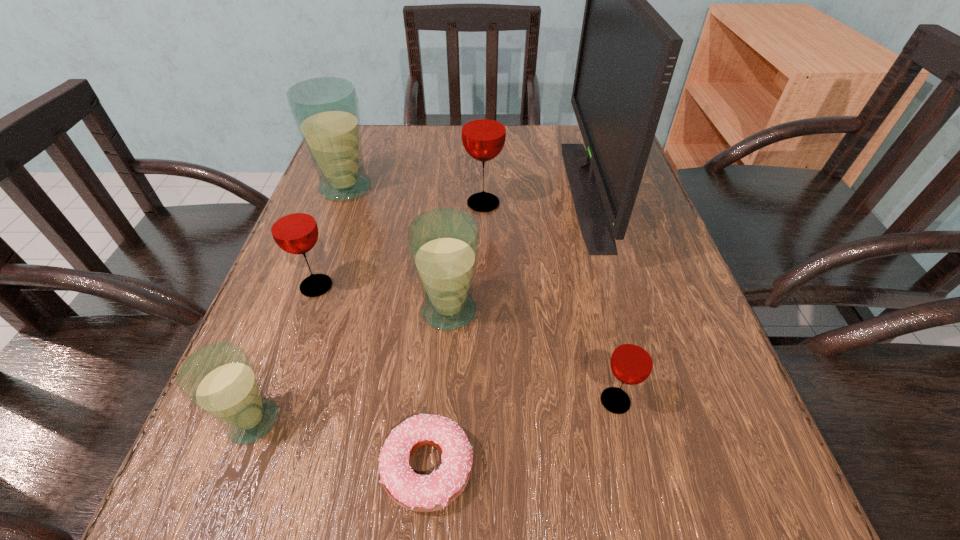
You are a GUI agent. You are given a task and a screenshot of the screen. Output one action in this format:
    pyautogui.click(x=<x>, y=<y>)
    Task: Click on the monitor
    The image size is (960, 540).
    Given the screenshot: What is the action you would take?
    pyautogui.click(x=627, y=54)

The height and width of the screenshot is (540, 960). Find the location of `the second red glass from left to right`. the second red glass from left to right is located at coordinates (483, 127).

Locate an element on the screen. Image resolution: width=960 pixels, height=540 pixels. the biggest red glass is located at coordinates (483, 127).

At what (x,y) coordinates should I click in order to perform the action: click on the biggest blue glass. Please return your answer as a coordinate pair (x, y). The height and width of the screenshot is (540, 960). Looking at the image, I should click on point(326,112).

Identify the location of the second biggest red glass. (293, 227).

You are a GUI agent. You are given a task and a screenshot of the screen. Output one action in this format:
    pyautogui.click(x=<x>, y=<y>)
    Task: Click on the second farthest red glass
    This screenshot has height=540, width=960.
    Given the screenshot: What is the action you would take?
    pyautogui.click(x=293, y=227)

Locate an element on the screen. the second biggest blue glass is located at coordinates (443, 243).

Locate an element on the screen. The width and height of the screenshot is (960, 540). the rightmost blue glass is located at coordinates (443, 243).

At what (x,y) coordinates should I click in order to perform the action: click on the rightmost red glass. Please return your answer as a coordinate pair (x, y). The width and height of the screenshot is (960, 540). Looking at the image, I should click on (632, 361).

Where is `the nearest red glass`? This screenshot has height=540, width=960. the nearest red glass is located at coordinates (632, 361).